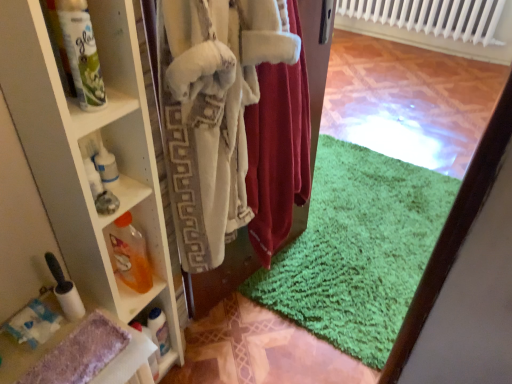
Describe the element at coordinates (90, 156) in the screenshot. I see `white glossy shelf at left` at that location.

What is the approximate height of white glossy spray bottle at upper left, positioned as the first bottle in front-to-back order?

white glossy spray bottle at upper left, positioned as the first bottle in front-to-back order, is 9.23 inches tall.

Identify the location of translucent orange liquid at shelf left, which appears as the second bottle when viewed from the top. (130, 254).

The height and width of the screenshot is (384, 512). I want to click on velvet red robe at center, which is counted as the first clothing, starting from the right, so click(x=277, y=154).

Where is `white glossy bottle at lower left, the 3th bottle when ordered from front to back`? white glossy bottle at lower left, the 3th bottle when ordered from front to back is located at coordinates (159, 330).

Find the location of a particular element. The image size is (512, 384). white glossy shelf at left is located at coordinates (90, 156).

Considering the sizes of objects translucent orange liquid at shelf left, the 2th bottle ordered from the bottom, and white glossy bottle at lower left, the 3th bottle from the top, in the image provided, who is taller, translucent orange liquid at shelf left, the 2th bottle ordered from the bottom, or white glossy bottle at lower left, the 3th bottle from the top,?

translucent orange liquid at shelf left, the 2th bottle ordered from the bottom, is taller.

How many degrees apart are the facing directions of translucent orange liquid at shelf left, the 2th bottle from the front, and white glossy bottle at lower left, the 3th bottle from the top?

They differ by 6.2 degrees in their facing directions.

Who is smaller, translucent orange liquid at shelf left, the 2th bottle ordered from the bottom, or white glossy bottle at lower left, the 3th bottle when ordered from front to back?

With smaller size is white glossy bottle at lower left, the 3th bottle when ordered from front to back.

Is translucent orange liquid at shelf left, the 2th bottle from the front, at the right side of white glossy bottle at lower left, the 3th bottle from the top?

No.

Who is taller, velvet red robe at center, which ranks as the 2th clothing in left-to-right order, or white fuzzy robe at center, which is the 1th clothing in left-to-right order?

white fuzzy robe at center, which is the 1th clothing in left-to-right order, is taller.

Does point (291, 86) come farther from viewer compared to point (218, 74)?

Yes.

Consider the image. Are velvet red robe at center, which ranks as the 2th clothing in left-to-right order, and white fuzzy robe at center, which is the 1th clothing in left-to-right order, making contact?

velvet red robe at center, which ranks as the 2th clothing in left-to-right order, and white fuzzy robe at center, which is the 1th clothing in left-to-right order, are clearly separated.

Is white glossy bottle at lower left, positioned as the 1th bottle in bottom-to-top order, placed right next to white glossy shelf at left?

No, white glossy bottle at lower left, positioned as the 1th bottle in bottom-to-top order, is not with white glossy shelf at left.

Considering the sizes of objects white glossy bottle at lower left, the 1th bottle from the back, and white glossy shelf at left in the image provided, who is thinner, white glossy bottle at lower left, the 1th bottle from the back, or white glossy shelf at left?

white glossy bottle at lower left, the 1th bottle from the back, is thinner.

How much distance is there between white glossy bottle at lower left, the 3th bottle when ordered from front to back, and white glossy shelf at left?

white glossy bottle at lower left, the 3th bottle when ordered from front to back, is 45.13 centimeters away from white glossy shelf at left.

Would you say white glossy shelf at left is part of white glossy bottle at lower left, positioned as the 1th bottle in bottom-to-top order,'s contents?

Actually, white glossy shelf at left is outside white glossy bottle at lower left, positioned as the 1th bottle in bottom-to-top order.

Which is behind, white glossy spray bottle at upper left, which is counted as the 3th bottle, starting from the back, or translucent orange liquid at shelf left, placed as the 2th bottle when sorted from back to front?

translucent orange liquid at shelf left, placed as the 2th bottle when sorted from back to front, is more distant.

From a real-world perspective, is white glossy spray bottle at upper left, positioned as the first bottle in front-to-back order, physically above translucent orange liquid at shelf left, which appears as the second bottle when viewed from the top?

Yes, from a real-world perspective, white glossy spray bottle at upper left, positioned as the first bottle in front-to-back order, is above translucent orange liquid at shelf left, which appears as the second bottle when viewed from the top.

How many degrees apart are the facing directions of white glossy spray bottle at upper left, which is counted as the 3th bottle, starting from the back, and translucent orange liquid at shelf left, which appears as the second bottle when viewed from the top?

The angular difference between white glossy spray bottle at upper left, which is counted as the 3th bottle, starting from the back, and translucent orange liquid at shelf left, which appears as the second bottle when viewed from the top, is 0.779 degrees.

Can you confirm if white glossy spray bottle at upper left, which is counted as the 3th bottle, starting from the back, is taller than translucent orange liquid at shelf left, placed as the 2th bottle when sorted from back to front?

Incorrect, the height of white glossy spray bottle at upper left, which is counted as the 3th bottle, starting from the back, is not larger of that of translucent orange liquid at shelf left, placed as the 2th bottle when sorted from back to front.

Would you say velvet red robe at center, which is counted as the first clothing, starting from the right, is outside white glossy bottle at lower left, the 3th bottle when ordered from front to back?

velvet red robe at center, which is counted as the first clothing, starting from the right, is positioned outside white glossy bottle at lower left, the 3th bottle when ordered from front to back.

From the image's perspective, which is above, velvet red robe at center, which ranks as the 2th clothing in left-to-right order, or white glossy bottle at lower left, the 1th bottle from the back?

velvet red robe at center, which ranks as the 2th clothing in left-to-right order, appears higher in the image.

Does velvet red robe at center, which is counted as the first clothing, starting from the right, have a smaller size compared to white glossy bottle at lower left, the 3th bottle from the top?

No.

Can you confirm if velvet red robe at center, which is counted as the first clothing, starting from the right, is wider than white glossy bottle at lower left, the 3th bottle from the top?

Indeed, velvet red robe at center, which is counted as the first clothing, starting from the right, has a greater width compared to white glossy bottle at lower left, the 3th bottle from the top.

Measure the distance between white glossy spray bottle at upper left, the 1th bottle from the top, and velvet red robe at center, which ranks as the 2th clothing in left-to-right order.

They are 25.71 inches apart.

Find the location of a particular element. The width and height of the screenshot is (512, 384). the 1st clothing below the white glossy spray bottle at upper left, the 1th bottle from the top (from a real-world perspective) is located at coordinates (277, 154).

Is white glossy spray bottle at upper left, which is the 3th bottle from bottom to top, closer to camera compared to velvet red robe at center, which is counted as the first clothing, starting from the right?

Yes, the depth of white glossy spray bottle at upper left, which is the 3th bottle from bottom to top, is less than that of velvet red robe at center, which is counted as the first clothing, starting from the right.

Considering the sizes of white glossy spray bottle at upper left, which is counted as the 3th bottle, starting from the back, and velvet red robe at center, which is counted as the first clothing, starting from the right, in the image, is white glossy spray bottle at upper left, which is counted as the 3th bottle, starting from the back, bigger or smaller than velvet red robe at center, which is counted as the first clothing, starting from the right,?

Clearly, white glossy spray bottle at upper left, which is counted as the 3th bottle, starting from the back, is smaller in size than velvet red robe at center, which is counted as the first clothing, starting from the right.

From a real-world perspective, is white glossy spray bottle at upper left, which is the 3th bottle from bottom to top, on white fuzzy robe at center, which is the 1th clothing in left-to-right order?

Yes, from a real-world perspective, white glossy spray bottle at upper left, which is the 3th bottle from bottom to top, is above white fuzzy robe at center, which is the 1th clothing in left-to-right order.

Does white glossy spray bottle at upper left, which is counted as the 3th bottle, starting from the back, have a larger size compared to white fuzzy robe at center, which appears as the 2th clothing when viewed from the right?

Incorrect, white glossy spray bottle at upper left, which is counted as the 3th bottle, starting from the back, is not larger than white fuzzy robe at center, which appears as the 2th clothing when viewed from the right.

Does white glossy spray bottle at upper left, positioned as the first bottle in front-to-back order, appear on the left side of white fuzzy robe at center, which is the 1th clothing in left-to-right order?

Indeed, white glossy spray bottle at upper left, positioned as the first bottle in front-to-back order, is positioned on the left side of white fuzzy robe at center, which is the 1th clothing in left-to-right order.

Is white fuzzy robe at center, which appears as the 2th clothing when viewed from the right, a part of white glossy spray bottle at upper left, the 1th bottle from the top?

No, white fuzzy robe at center, which appears as the 2th clothing when viewed from the right, is not surrounded by white glossy spray bottle at upper left, the 1th bottle from the top.

Which bottle is the 1st one when counting from the front of the white glossy bottle at lower left, the 3th bottle from the top? Please provide its 2D coordinates.

[(130, 254)]

You are a GUI agent. You are given a task and a screenshot of the screen. Output one action in this format:
    pyautogui.click(x=<x>, y=<y>)
    Task: Click on the clothing that appears above the white fuzzy robe at center, which is the 1th clothing in left-to-right order (from the image's perspective)
    The image size is (512, 384).
    Given the screenshot: What is the action you would take?
    pyautogui.click(x=277, y=154)

Looking at this image, looking at the image, which one is located closer to white fuzzy robe at center, which appears as the 2th clothing when viewed from the right, velvet red robe at center, which ranks as the 2th clothing in left-to-right order, or white glossy shelf at left?

velvet red robe at center, which ranks as the 2th clothing in left-to-right order, is closer to white fuzzy robe at center, which appears as the 2th clothing when viewed from the right.

Looking at the image, which one is located closer to white fuzzy robe at center, which appears as the 2th clothing when viewed from the right, translucent orange liquid at shelf left, which appears as the second bottle when viewed from the top, or velvet red robe at center, which is counted as the first clothing, starting from the right?

velvet red robe at center, which is counted as the first clothing, starting from the right, lies closer to white fuzzy robe at center, which appears as the 2th clothing when viewed from the right, than the other object.

Based on their spatial positions, is white glossy bottle at lower left, the 1th bottle from the back, or velvet red robe at center, which is counted as the first clothing, starting from the right, further from white glossy spray bottle at upper left, the 1th bottle from the top?

Based on the image, white glossy bottle at lower left, the 1th bottle from the back, appears to be further to white glossy spray bottle at upper left, the 1th bottle from the top.

Estimate the real-world distances between objects in this image. Which object is further from white glossy bottle at lower left, positioned as the 1th bottle in bottom-to-top order, white glossy spray bottle at upper left, which is counted as the 3th bottle, starting from the back, or white fuzzy robe at center, which is the 1th clothing in left-to-right order?

Based on the image, white glossy spray bottle at upper left, which is counted as the 3th bottle, starting from the back, appears to be further to white glossy bottle at lower left, positioned as the 1th bottle in bottom-to-top order.

Estimate the real-world distances between objects in this image. Which object is further from white glossy spray bottle at upper left, which is the 3th bottle from bottom to top, velvet red robe at center, which ranks as the 2th clothing in left-to-right order, or translucent orange liquid at shelf left, placed as the 2th bottle when sorted from back to front?

velvet red robe at center, which ranks as the 2th clothing in left-to-right order.

Which object lies further to the anchor point translucent orange liquid at shelf left, which appears as the second bottle when viewed from the top, velvet red robe at center, which is counted as the first clothing, starting from the right, or white fuzzy robe at center, which is the 1th clothing in left-to-right order?

velvet red robe at center, which is counted as the first clothing, starting from the right, is positioned further to the anchor translucent orange liquid at shelf left, which appears as the second bottle when viewed from the top.

From the image, which object appears to be nearer to translucent orange liquid at shelf left, placed as the 2th bottle when sorted from back to front, white fuzzy robe at center, which is the 1th clothing in left-to-right order, or white glossy spray bottle at upper left, positioned as the first bottle in front-to-back order?

white fuzzy robe at center, which is the 1th clothing in left-to-right order, lies closer to translucent orange liquid at shelf left, placed as the 2th bottle when sorted from back to front, than the other object.

From the image, which object appears to be farther from white glossy bottle at lower left, the 3th bottle from the top, white fuzzy robe at center, which is the 1th clothing in left-to-right order, or velvet red robe at center, which is counted as the first clothing, starting from the right?

Among the two, velvet red robe at center, which is counted as the first clothing, starting from the right, is located further to white glossy bottle at lower left, the 3th bottle from the top.

The width and height of the screenshot is (512, 384). I want to click on clothing situated between white glossy shelf at left and velvet red robe at center, which is counted as the first clothing, starting from the right, from left to right, so click(213, 112).

Identify the location of clothing located between white fuzzy robe at center, which is the 1th clothing in left-to-right order, and translucent orange liquid at shelf left, placed as the 2th bottle when sorted from back to front, in the depth direction. (277, 154).

Identify the location of bottle between velvet red robe at center, which ranks as the 2th clothing in left-to-right order, and white glossy bottle at lower left, positioned as the 1th bottle in bottom-to-top order, in the vertical direction. This screenshot has height=384, width=512. click(x=130, y=254).

Where is `clothing between white fuzzy robe at center, which is the 1th clothing in left-to-right order, and white glossy bottle at lower left, the 3th bottle when ordered from front to back, along the z-axis`? clothing between white fuzzy robe at center, which is the 1th clothing in left-to-right order, and white glossy bottle at lower left, the 3th bottle when ordered from front to back, along the z-axis is located at coordinates (277, 154).